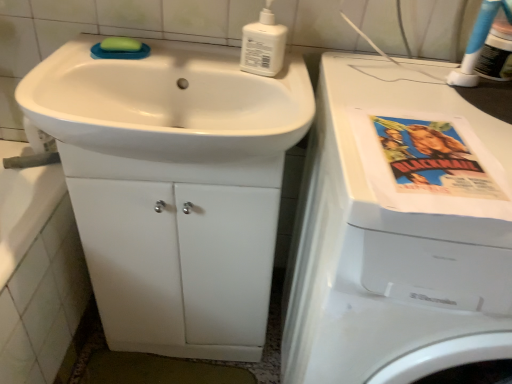
Question: Are white plastic washing machine at right and green matte soap at upper left beside each other?

Choices:
 (A) yes
 (B) no

Answer: (B)

Question: Considering the relative positions of white plastic washing machine at right and green matte soap at upper left in the image provided, is white plastic washing machine at right in front of green matte soap at upper left?

Choices:
 (A) no
 (B) yes

Answer: (B)

Question: Is white plastic washing machine at right bigger than green matte soap at upper left?

Choices:
 (A) yes
 (B) no

Answer: (A)

Question: Is the position of white plastic washing machine at right more distant than that of green matte soap at upper left?

Choices:
 (A) no
 (B) yes

Answer: (A)

Question: Is white plastic washing machine at right not within green matte soap at upper left?

Choices:
 (A) no
 (B) yes

Answer: (B)

Question: In terms of width, does white glossy cabinet at center look wider or thinner when compared to green matte soap at upper left?

Choices:
 (A) thin
 (B) wide

Answer: (B)

Question: From the image's perspective, is white glossy cabinet at center located above or below green matte soap at upper left?

Choices:
 (A) above
 (B) below

Answer: (B)

Question: Is white glossy cabinet at center situated inside green matte soap at upper left or outside?

Choices:
 (A) inside
 (B) outside

Answer: (B)

Question: Does point (159, 228) appear closer or farther from the camera than point (132, 44)?

Choices:
 (A) farther
 (B) closer

Answer: (A)

Question: Choose the correct answer: Is white plastic bottle at upper center inside white plastic washing machine at right or outside it?

Choices:
 (A) outside
 (B) inside

Answer: (A)

Question: From a real-world perspective, is white plastic bottle at upper center physically located above or below white plastic washing machine at right?

Choices:
 (A) below
 (B) above

Answer: (B)

Question: Based on their sizes in the image, would you say white plastic bottle at upper center is bigger or smaller than white plastic washing machine at right?

Choices:
 (A) small
 (B) big

Answer: (A)

Question: Considering the positions of point tap(271, 44) and point tap(408, 307), is point tap(271, 44) closer or farther from the camera than point tap(408, 307)?

Choices:
 (A) closer
 (B) farther

Answer: (B)

Question: Considering the relative positions of white glossy cabinet at center and white plastic bottle at upper center in the image provided, is white glossy cabinet at center to the left or to the right of white plastic bottle at upper center?

Choices:
 (A) right
 (B) left

Answer: (B)

Question: From the image's perspective, relative to white plastic bottle at upper center, is white glossy cabinet at center above or below?

Choices:
 (A) above
 (B) below

Answer: (B)